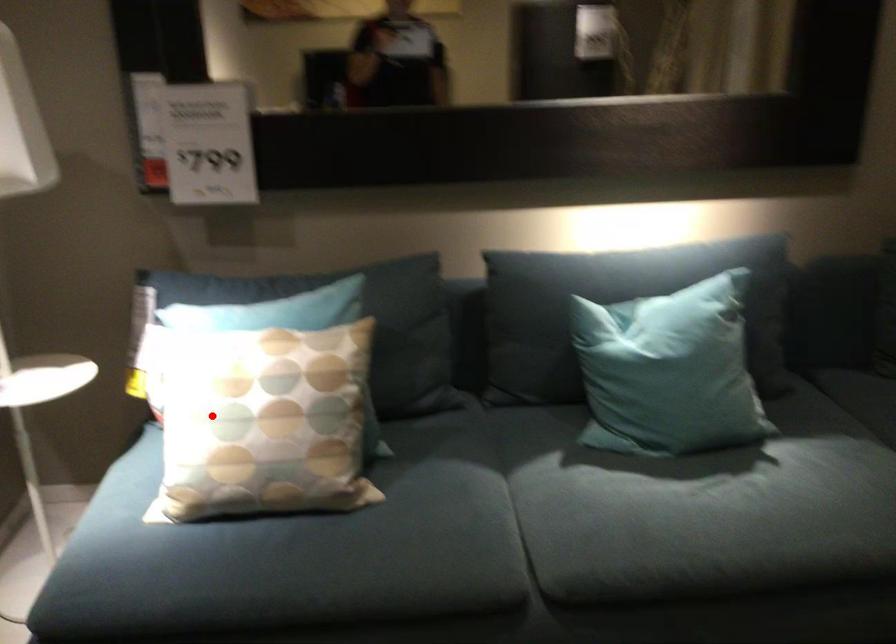
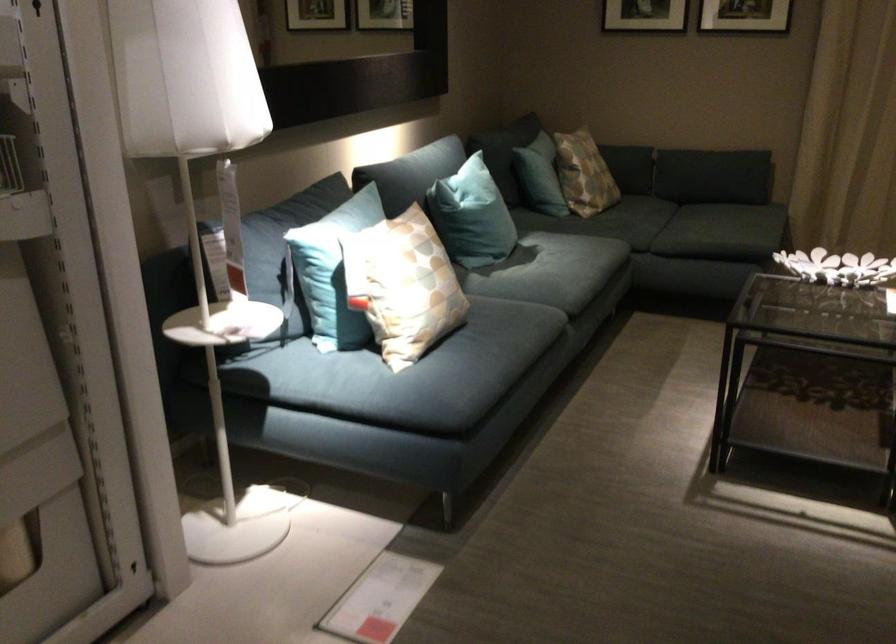
In the second image, find the point that corresponds to the highlighted location in the first image.

(402, 285)